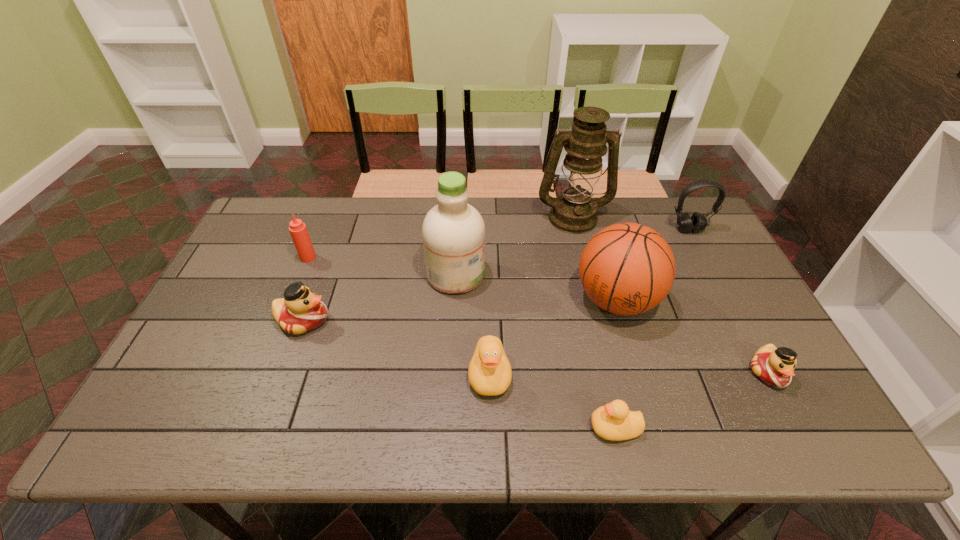
The width and height of the screenshot is (960, 540). Find the location of `vacant space that's between the right red duck and the second tallest object`. vacant space that's between the right red duck and the second tallest object is located at coordinates (612, 323).

I want to click on free spot between the second tallest object and the basketball, so click(536, 287).

I want to click on vacant space that's between the second tallest object and the bigger yellow duck, so click(472, 324).

In order to click on free spot between the basketball and the right red duck in this screenshot , I will do `click(692, 336)`.

You are a GUI agent. You are given a task and a screenshot of the screen. Output one action in this format:
    pyautogui.click(x=<x>, y=<y>)
    Task: Click on the empty space that is in between the farther yellow duck and the left red duck
    This screenshot has width=960, height=540.
    Given the screenshot: What is the action you would take?
    point(396,347)

Select which object is the fifth closest to the nearest object. Please provide its 2D coordinates. Your answer should be formatted as a tuple, i.e. [(x, y)], where the tuple contains the x and y coordinates of a point satisfying the conditions above.

[(574, 211)]

Point out which object is positioned as the sixth nearest to the cleansing agent. Please provide its 2D coordinates. Your answer should be formatted as a tuple, i.e. [(x, y)], where the tuple contains the x and y coordinates of a point satisfying the conditions above.

[(614, 421)]

Choose which duck is the third nearest neighbor to the headset. Please provide its 2D coordinates. Your answer should be formatted as a tuple, i.e. [(x, y)], where the tuple contains the x and y coordinates of a point satisfying the conditions above.

[(489, 372)]

At what (x,y) coordinates should I click in order to perform the action: click on the fourth closest duck to the Tabasco sauce. Please return your answer as a coordinate pair (x, y). The image size is (960, 540). Looking at the image, I should click on (774, 366).

Where is `free space that satisfies the following two spatial constraints: 1. on the back side of the Tabasco sauce; 2. on the right side of the oil lamp`? free space that satisfies the following two spatial constraints: 1. on the back side of the Tabasco sauce; 2. on the right side of the oil lamp is located at coordinates (324, 217).